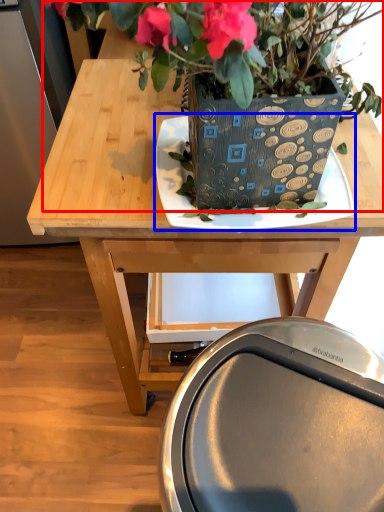
Question: Which object is further to the camera taking this photo, houseplant (highlighted by a red box) or plate (highlighted by a blue box)?

Choices:
 (A) houseplant
 (B) plate

Answer: (B)